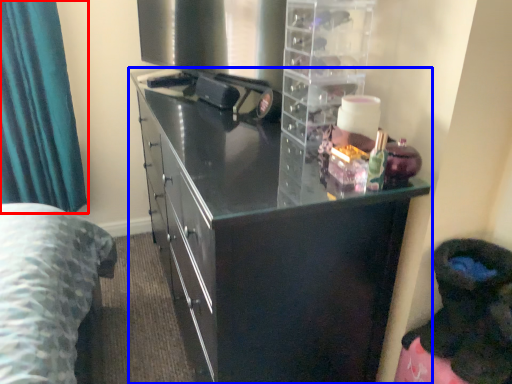
Question: Among these objects, which one is farthest to the camera, curtain (highlighted by a red box) or cupboard (highlighted by a blue box)?

Choices:
 (A) curtain
 (B) cupboard

Answer: (A)